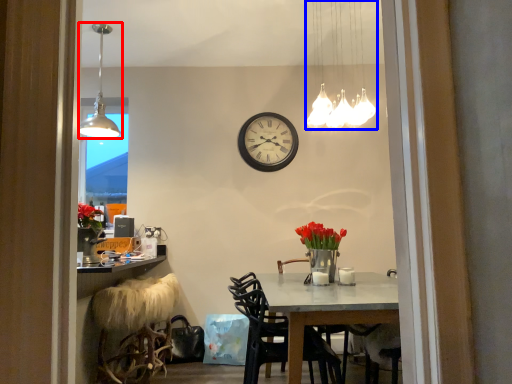
Question: Which of the following is the closest to the observer, lamp (highlighted by a red box) or lamp (highlighted by a blue box)?

Choices:
 (A) lamp
 (B) lamp

Answer: (B)